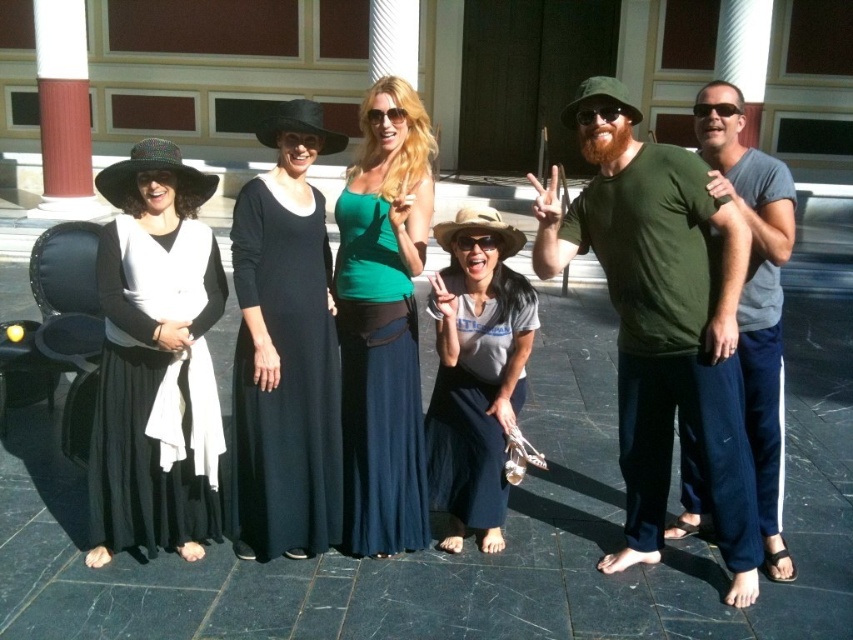
You are a photographer taking a picture of the group. You notice two points in the image at coordinates point (241, 298) and point (775, 260). Which point is closer to your camera?

Point (241, 298) is closer to the camera than point (775, 260).

You are standing in front of the classical building and want to find the black matte dress at left. According to the coordinates given, where should you look to locate it?

The black matte dress at left is located at the 2D coordinates point (155, 392).

You are standing in front of the classical building and want to take a photo of the two points marked in the image. Which point, point (137, 396) or point (289, 419), is closer to you?

Point (137, 396) is closer to you than point (289, 419).